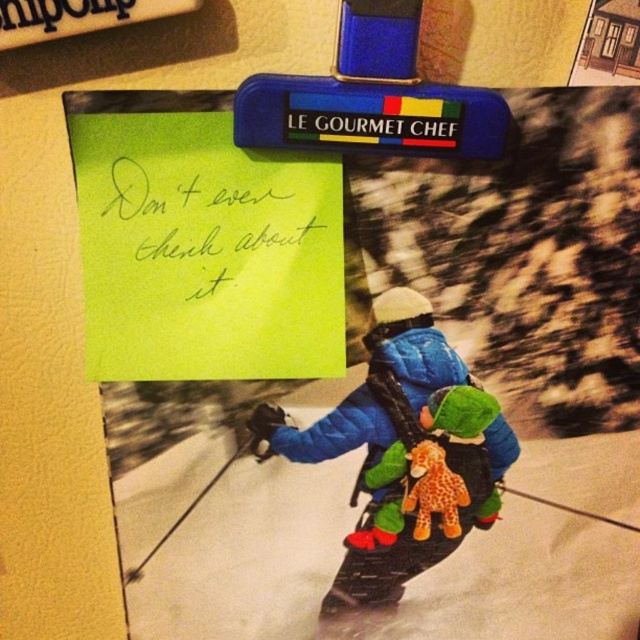
Question: Does yellow paper at upper left have a lesser width compared to soft plush giraffe at center?

Choices:
 (A) yes
 (B) no

Answer: (B)

Question: Which of the following is the farthest from the observer?

Choices:
 (A) yellow paper at upper left
 (B) soft plush giraffe at center

Answer: (B)

Question: Which point is closer to the camera?

Choices:
 (A) (410, 545)
 (B) (445, 525)

Answer: (B)

Question: Can you confirm if blue quilted jacket at center is smaller than yellow paper at upper left?

Choices:
 (A) no
 (B) yes

Answer: (A)

Question: Which of the following is the farthest from the observer?

Choices:
 (A) (429, 522)
 (B) (260, 284)

Answer: (A)

Question: Is blue quilted jacket at center bigger than soft plush giraffe at center?

Choices:
 (A) no
 (B) yes

Answer: (B)